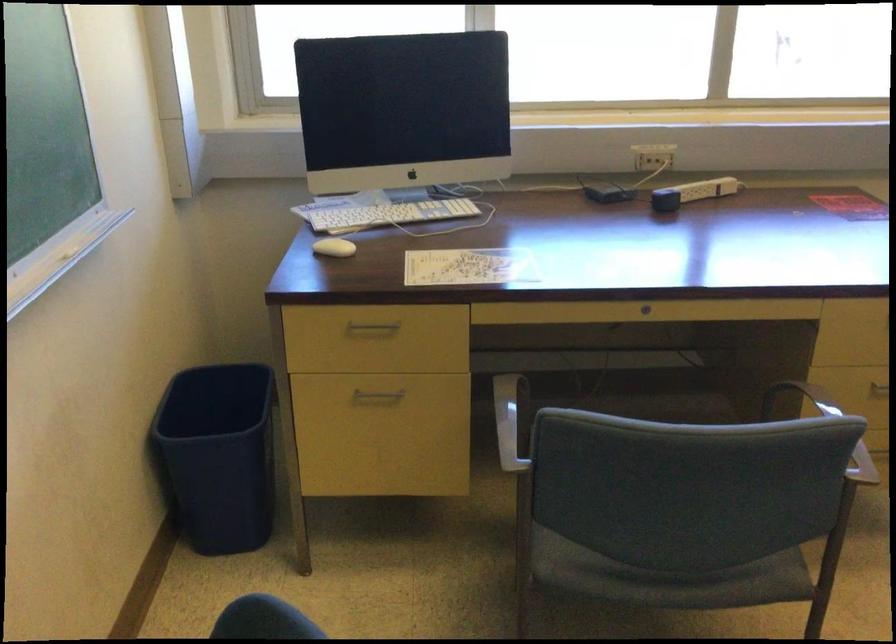
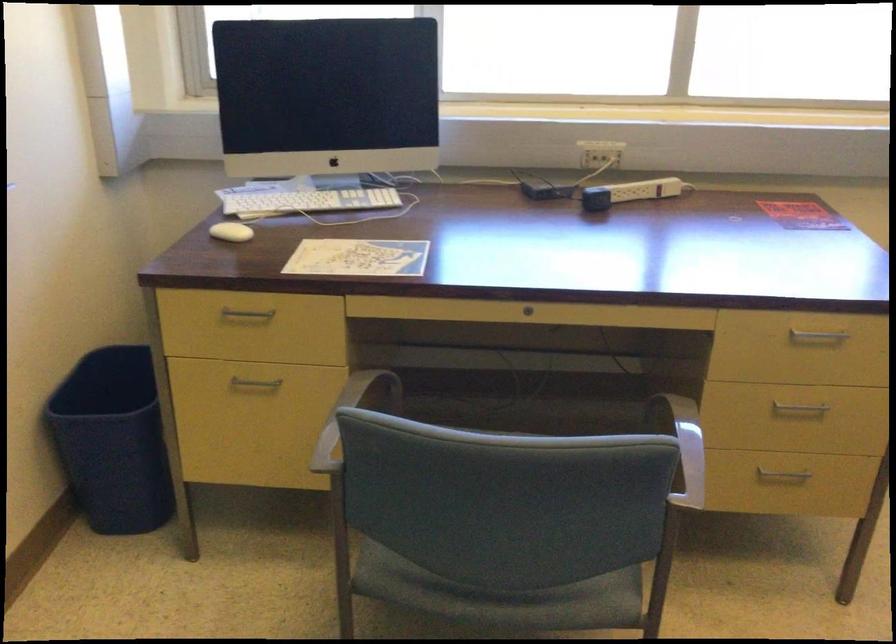
Question: How did the camera likely rotate?

Choices:
 (A) Left
 (B) Right
 (C) Up
 (D) Down

Answer: (A)